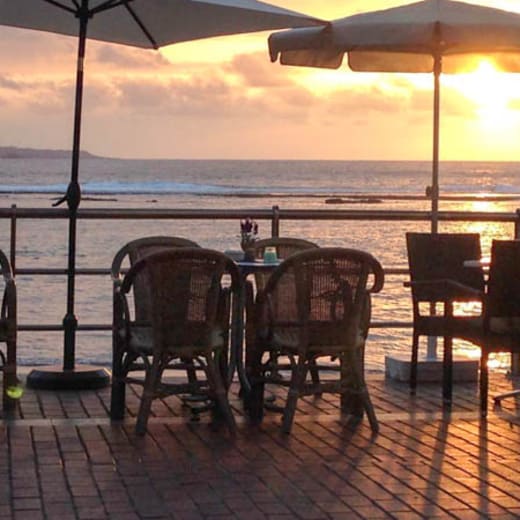
Identify the location of chairs. (11, 329), (165, 326), (135, 252), (281, 307), (296, 243), (456, 249), (507, 296).